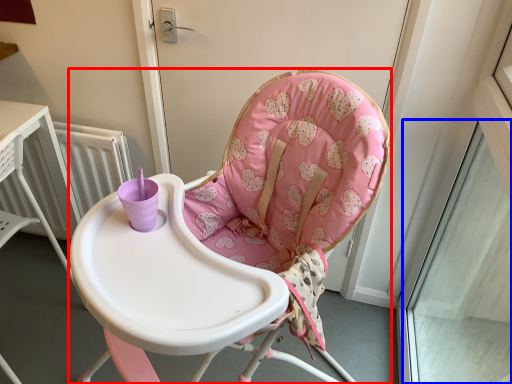
Question: Which of the following is the farthest to the observer, chair (highlighted by a red box) or window (highlighted by a blue box)?

Choices:
 (A) chair
 (B) window

Answer: (B)